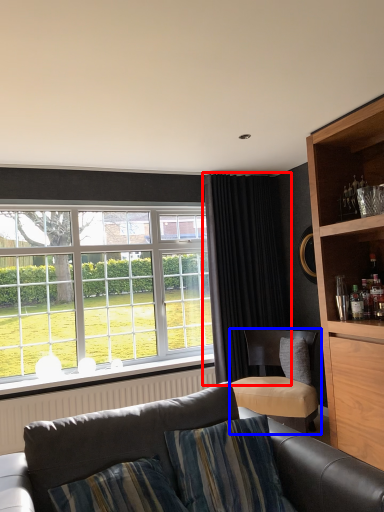
Question: Which point is closer to the camera, curtain (highlighted by a red box) or chair (highlighted by a blue box)?

Choices:
 (A) curtain
 (B) chair

Answer: (B)